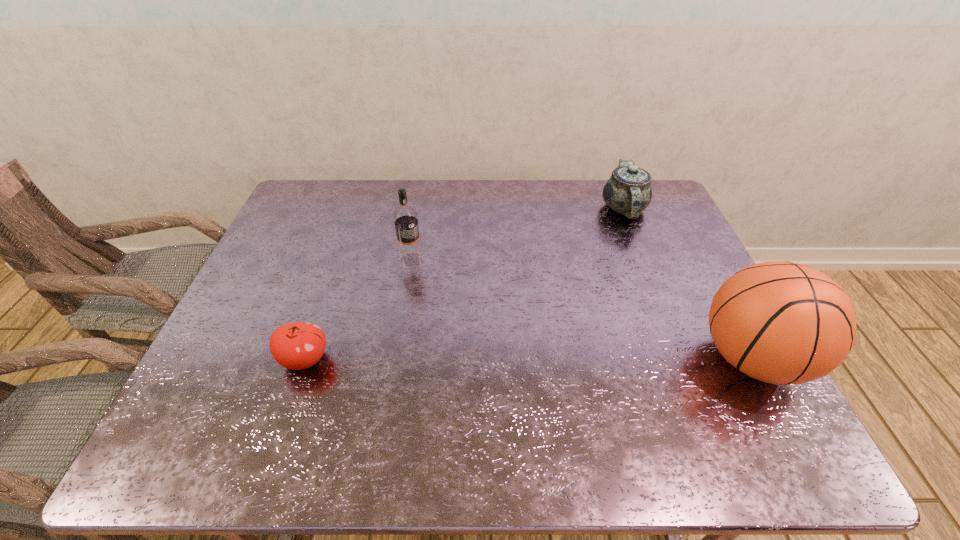
Image resolution: width=960 pixels, height=540 pixels. I want to click on vacant space that satisfies the following two spatial constraints: 1. on the back side of the third tallest object; 2. on the left side of the apple, so click(357, 208).

Where is `vacant space that satisfies the following two spatial constraints: 1. on the front side of the basketball; 2. on the right side of the second farthest object`? Image resolution: width=960 pixels, height=540 pixels. vacant space that satisfies the following two spatial constraints: 1. on the front side of the basketball; 2. on the right side of the second farthest object is located at coordinates (395, 359).

This screenshot has width=960, height=540. Identify the location of free space that satisfies the following two spatial constraints: 1. on the back side of the basketball; 2. on the left side of the shortest object. (305, 359).